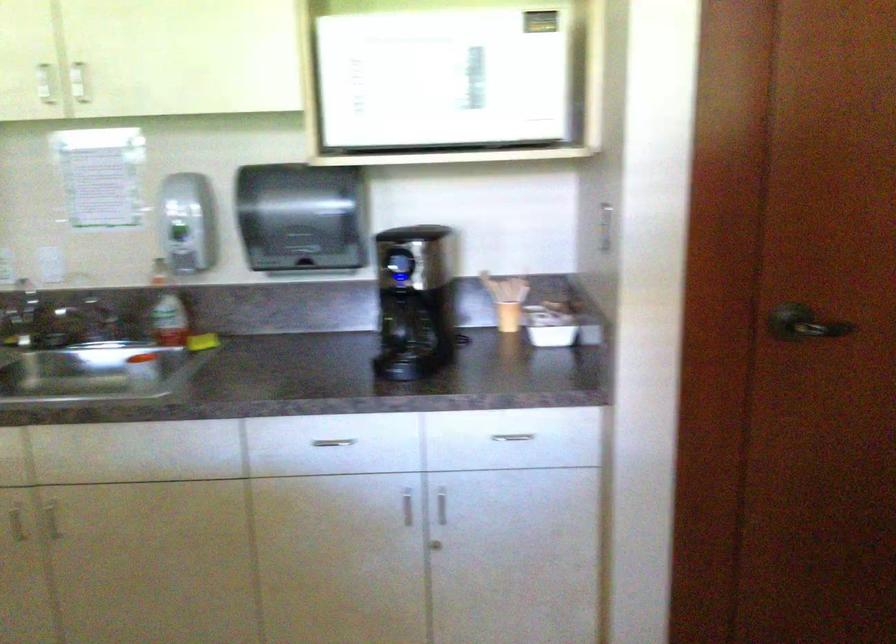
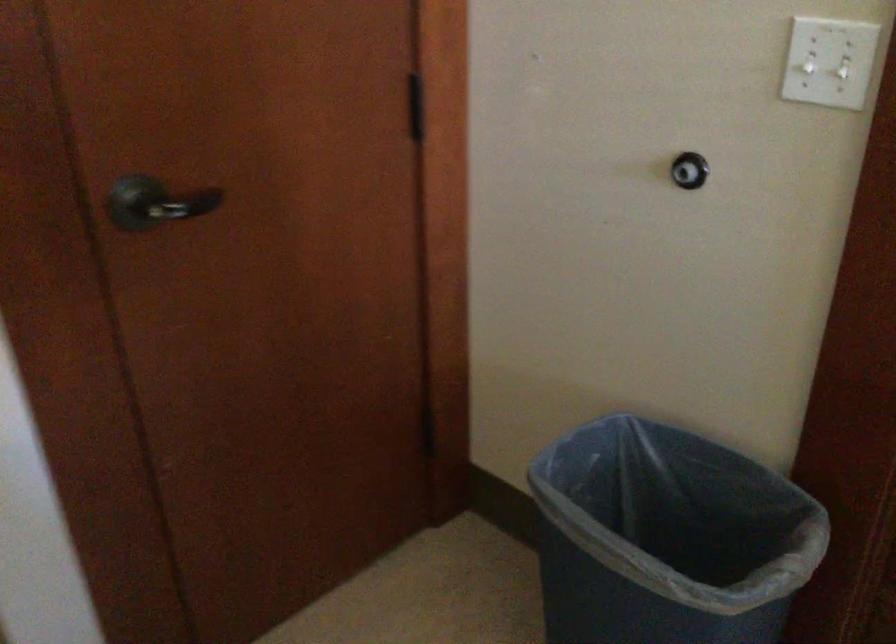
Find the pixel in the second image that matches point (787, 317) in the first image.

(156, 203)